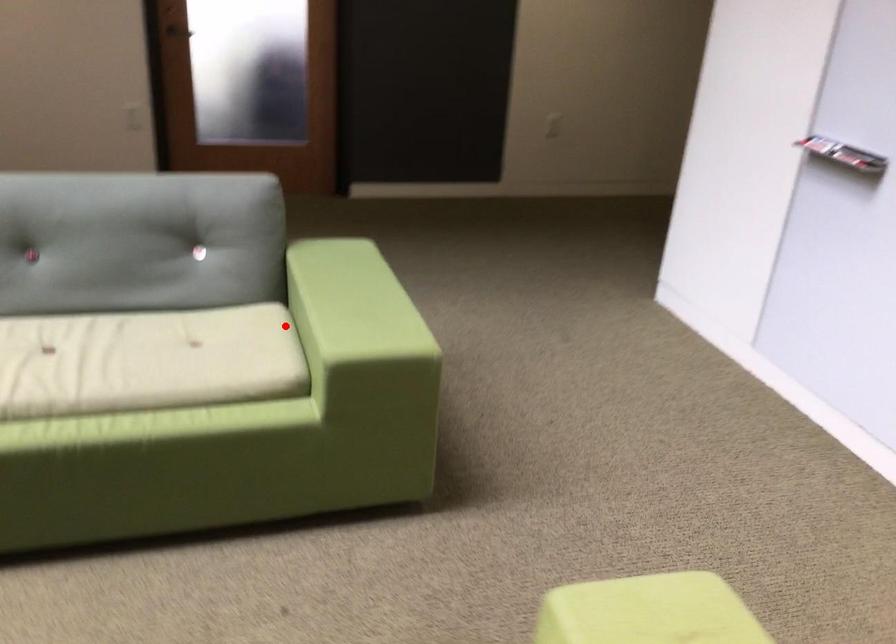
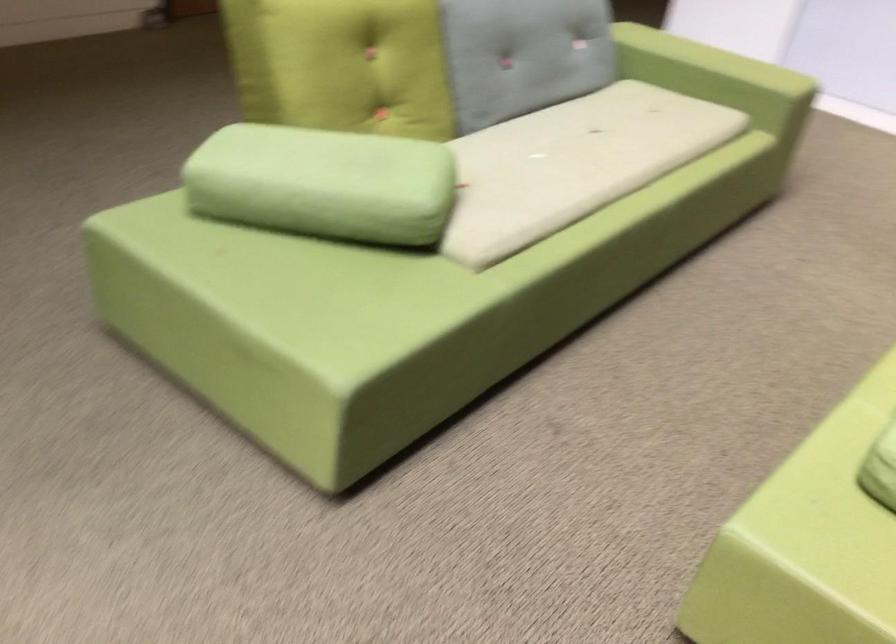
In the second image, find the point that corresponds to the highlighted location in the first image.

(717, 77)